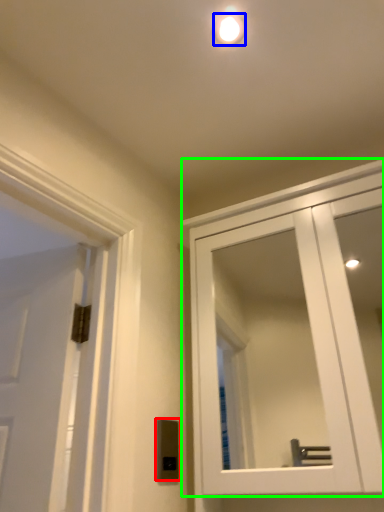
Question: Considering the real-world distances, which object is closest to light switch (highlighted by a red box)? droplight (highlighted by a blue box) or cabinetry (highlighted by a green box).

Choices:
 (A) droplight
 (B) cabinetry

Answer: (A)